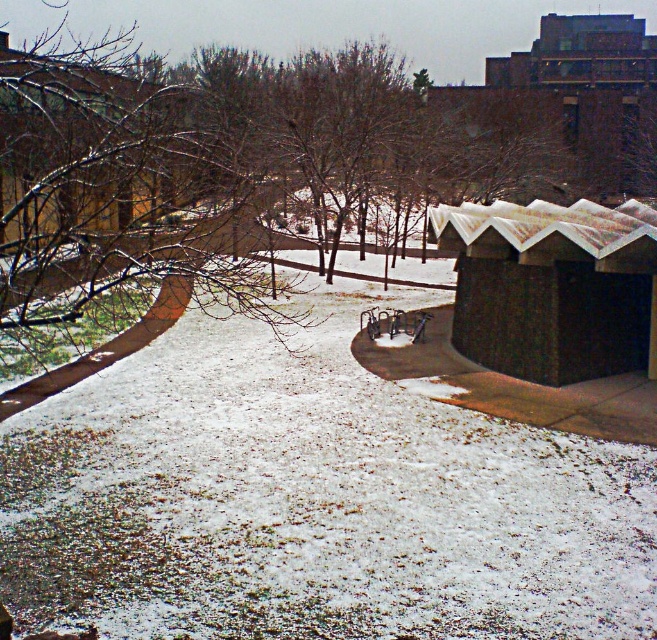
Question: Estimate the real-world distances between objects in this image. Which object is farther from the brown bare branches at upper left?

Choices:
 (A) brown wooden hut at upper left
 (B) brown textured shelter at right

Answer: (B)

Question: Does brown textured shelter at right appear under brown wooden hut at upper left?

Choices:
 (A) yes
 (B) no

Answer: (A)

Question: Which is nearer to the brown wooden hut at upper left?

Choices:
 (A) brown textured shelter at right
 (B) brown bare branches at upper left

Answer: (B)

Question: Does brown textured shelter at right have a greater width compared to brown wooden hut at upper left?

Choices:
 (A) no
 (B) yes

Answer: (A)

Question: Among these points, which one is farthest from the camera?

Choices:
 (A) pos(495,214)
 (B) pos(256,198)
 (C) pos(85,124)

Answer: (B)

Question: Is the position of brown textured shelter at right more distant than that of brown wooden hut at upper left?

Choices:
 (A) yes
 (B) no

Answer: (A)